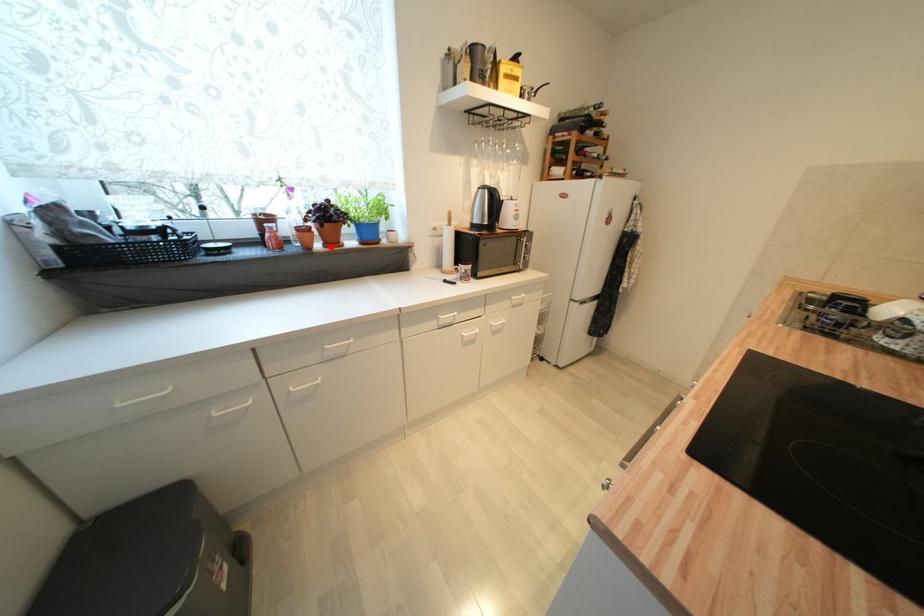
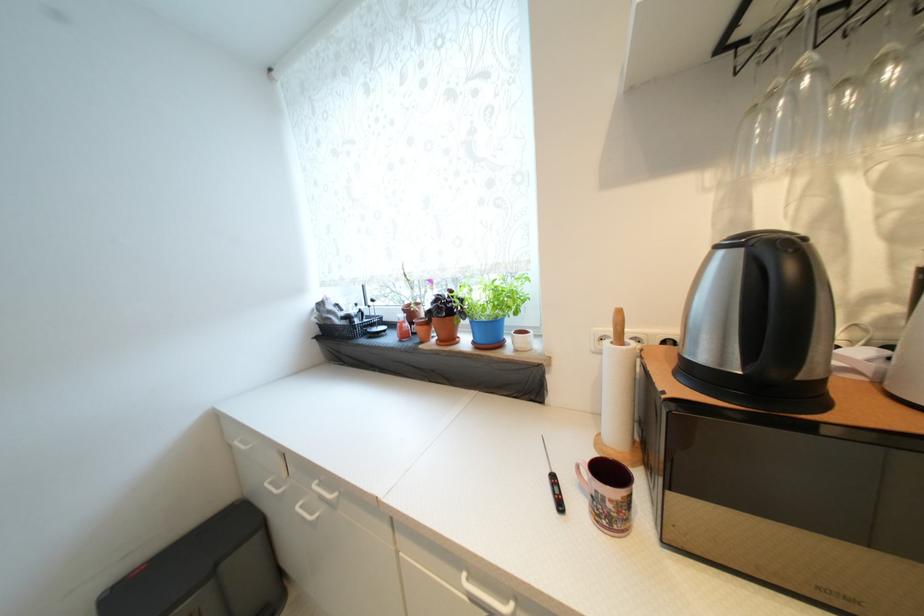
Locate, in the second image, the point that corresponds to the highlighted location in the first image.

(445, 342)